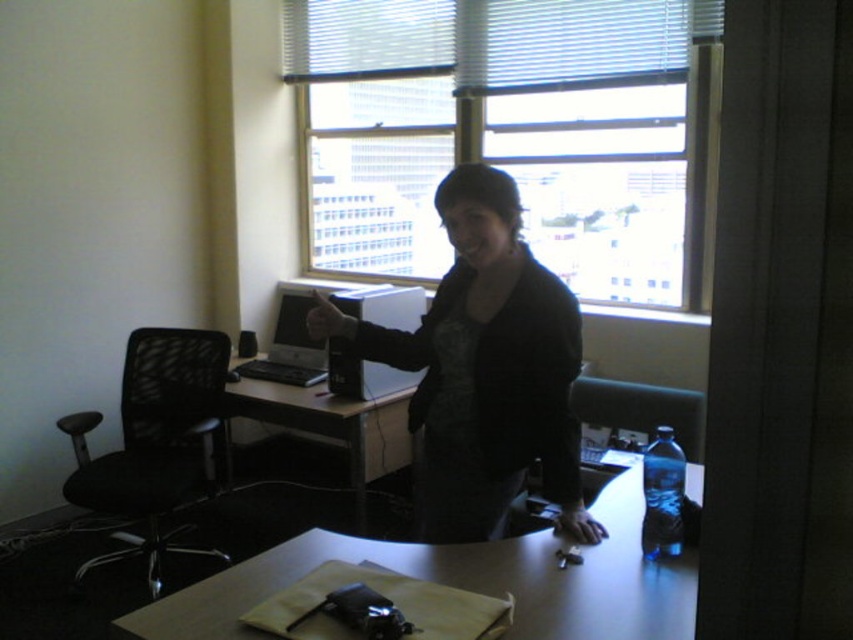
You are an office worker who needs to move a document from the desk to the black office chair next to the desk. The path between the black matte shirt at center and the matte black monitor at center is 1.2 meters. Can you walk through this path without bending sideways?

The path between the black matte shirt at center and the matte black monitor at center is 1.2 meters. Since the average person requires about 0.6 meters of width to walk comfortably, the path is wide enough for you to walk through without needing to bend sideways.

Consider the image. You are a delivery person who needs to place a 1.8 meter long package on the floor between the white glossy computer desk at center and the silver metallic laptop at center. Can the package fit in that space?

The distance between the white glossy computer desk at center and the silver metallic laptop at center is 1.76 meters. Since the package is 1.8 meters long, it cannot fit in the available space.